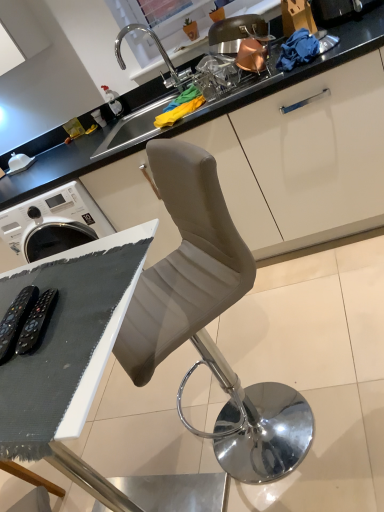
This screenshot has width=384, height=512. Describe the element at coordinates (239, 33) in the screenshot. I see `satin nickel sink at upper center` at that location.

I want to click on suede-like gray chair at center, so click(209, 320).

Describe the element at coordinates (304, 67) in the screenshot. The image size is (384, 512). I see `matte white cabinet at upper center` at that location.

Identify the location of satin nickel sink at upper center. This screenshot has width=384, height=512. (239, 33).

Can you tell me how much matte white cabinet at upper center and satin nickel sink at upper center differ in facing direction?

The angular difference between matte white cabinet at upper center and satin nickel sink at upper center is 0.0235 degrees.

How distant is matte white cabinet at upper center from satin nickel sink at upper center?

matte white cabinet at upper center is 67.47 centimeters from satin nickel sink at upper center.

Considering the points (61, 183) and (227, 49), which point is in front, point (61, 183) or point (227, 49)?

The point (227, 49) is closer.

Are matte white cabinet at upper center and satin nickel sink at upper center beside each other?

matte white cabinet at upper center and satin nickel sink at upper center are not in contact.

Is white matte table at lower left wider or thinner than suede-like gray chair at center?

white matte table at lower left is thinner than suede-like gray chair at center.

The width and height of the screenshot is (384, 512). Find the location of `table that appears on the left of suede-like gray chair at center`. table that appears on the left of suede-like gray chair at center is located at coordinates (70, 353).

Is white matte table at lower left oriented away from suede-like gray chair at center?

No, white matte table at lower left is not facing away from suede-like gray chair at center.

Is the position of white matte table at lower left more distant than that of suede-like gray chair at center?

No, it is not.

In order to click on chair below the matte white cabinet at upper center (from a real-world perspective) in this screenshot , I will do pos(209,320).

In terms of size, does suede-like gray chair at center appear bigger or smaller than matte white cabinet at upper center?

Considering their sizes, suede-like gray chair at center takes up less space than matte white cabinet at upper center.

Between suede-like gray chair at center and matte white cabinet at upper center, which one is positioned in front?

suede-like gray chair at center is in front.

Is suede-like gray chair at center not close to matte white cabinet at upper center?

That's not correct — suede-like gray chair at center is a little close to matte white cabinet at upper center.

In terms of height, does satin nickel sink at upper center look taller or shorter compared to suede-like gray chair at center?

In the image, satin nickel sink at upper center appears to be taller than suede-like gray chair at center.

The image size is (384, 512). What are the coordinates of `chair on the right of the satin nickel sink at upper center` in the screenshot? It's located at (209, 320).

Which is behind, satin nickel sink at upper center or suede-like gray chair at center?

satin nickel sink at upper center is behind.

Between satin nickel sink at upper center and suede-like gray chair at center, which one has smaller size?

satin nickel sink at upper center.

Is suede-like gray chair at center shorter than satin nickel sink at upper center?

Correct, suede-like gray chair at center is not as tall as satin nickel sink at upper center.

Does suede-like gray chair at center have a smaller size compared to satin nickel sink at upper center?

Incorrect, suede-like gray chair at center is not smaller in size than satin nickel sink at upper center.

From a real-world perspective, relative to satin nickel sink at upper center, is suede-like gray chair at center vertically above or below?

Clearly, from a real-world perspective, suede-like gray chair at center is below satin nickel sink at upper center.

Which is in front, point (263, 400) or point (238, 45)?

The point (263, 400) is more forward.

Considering the relative sizes of white matte table at lower left and matte white cabinet at upper center in the image provided, is white matte table at lower left bigger than matte white cabinet at upper center?

Actually, white matte table at lower left might be smaller than matte white cabinet at upper center.

Is point (32, 448) less distant than point (333, 54)?

Yes, it is.

Considering the sizes of objects white matte table at lower left and matte white cabinet at upper center in the image provided, who is thinner, white matte table at lower left or matte white cabinet at upper center?

Thinner between the two is matte white cabinet at upper center.

Is white matte table at lower left looking in the opposite direction of matte white cabinet at upper center?

No, white matte table at lower left is not facing the opposite direction of matte white cabinet at upper center.

From the picture: Considering the positions of objects satin nickel sink at upper center and white matte table at lower left in the image provided, who is more to the right, satin nickel sink at upper center or white matte table at lower left?

Positioned to the right is satin nickel sink at upper center.

Choose the correct answer: Is satin nickel sink at upper center inside white matte table at lower left or outside it?

satin nickel sink at upper center is not enclosed by white matte table at lower left.

Considering their positions, is satin nickel sink at upper center located in front of or behind white matte table at lower left?

Clearly, satin nickel sink at upper center is behind white matte table at lower left.

How different are the orientations of satin nickel sink at upper center and white matte table at lower left in degrees?

The facing directions of satin nickel sink at upper center and white matte table at lower left are 174 degrees apart.

You are a GUI agent. You are given a task and a screenshot of the screen. Output one action in this format:
    pyautogui.click(x=<x>, y=<y>)
    Task: Click on the cabinetry that appears on the left of satin nickel sink at upper center
    
    Given the screenshot: What is the action you would take?
    pyautogui.click(x=304, y=67)

What are the coordinates of `chair on the right of white matte table at lower left` in the screenshot? It's located at 209,320.

Estimate the real-world distances between objects in this image. Which object is further from satin nickel sink at upper center, white matte table at lower left or suede-like gray chair at center?

The object further to satin nickel sink at upper center is white matte table at lower left.

Considering their positions, is satin nickel sink at upper center positioned closer to white matte table at lower left than matte white cabinet at upper center?

matte white cabinet at upper center is positioned closer to the anchor white matte table at lower left.

Estimate the real-world distances between objects in this image. Which object is further from matte white cabinet at upper center, white matte table at lower left or satin nickel sink at upper center?

white matte table at lower left is positioned further to the anchor matte white cabinet at upper center.

Based on their spatial positions, is suede-like gray chair at center or white matte table at lower left further from satin nickel sink at upper center?

white matte table at lower left is positioned further to the anchor satin nickel sink at upper center.

Estimate the real-world distances between objects in this image. Which object is closer to satin nickel sink at upper center, matte white cabinet at upper center or white matte table at lower left?

matte white cabinet at upper center is closer to satin nickel sink at upper center.

Based on their spatial positions, is matte white cabinet at upper center or suede-like gray chair at center closer to satin nickel sink at upper center?

The object closer to satin nickel sink at upper center is matte white cabinet at upper center.

Which object lies nearer to the anchor point white matte table at lower left, suede-like gray chair at center or satin nickel sink at upper center?

The object closer to white matte table at lower left is suede-like gray chair at center.

Consider the image. Considering their positions, is suede-like gray chair at center positioned further to white matte table at lower left than matte white cabinet at upper center?

Among the two, matte white cabinet at upper center is located further to white matte table at lower left.

Where is `table between satin nickel sink at upper center and suede-like gray chair at center vertically`? This screenshot has height=512, width=384. table between satin nickel sink at upper center and suede-like gray chair at center vertically is located at coordinates (70, 353).

Where is `cabinetry between white matte table at lower left and satin nickel sink at upper center in the front-back direction`? The image size is (384, 512). cabinetry between white matte table at lower left and satin nickel sink at upper center in the front-back direction is located at coordinates 304,67.

Locate an element on the screen. This screenshot has height=512, width=384. table between matte white cabinet at upper center and suede-like gray chair at center vertically is located at coordinates (70, 353).

Find the location of a particular element. This screenshot has width=384, height=512. cabinetry between satin nickel sink at upper center and suede-like gray chair at center from top to bottom is located at coordinates (304, 67).